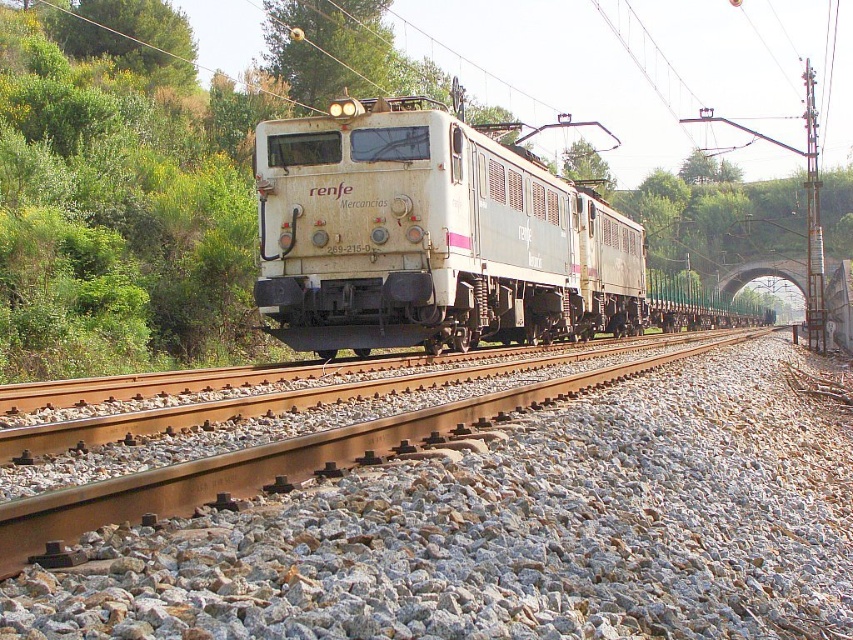
The width and height of the screenshot is (853, 640). Describe the element at coordinates (514, 532) in the screenshot. I see `gray gravel at center` at that location.

Is point (544, 438) closer to camera compared to point (415, 188)?

Yes, it is.

Which is in front, point (111, 628) or point (474, 305)?

Point (111, 628)

Locate an element on the screen. This screenshot has width=853, height=640. gray gravel at center is located at coordinates (514, 532).